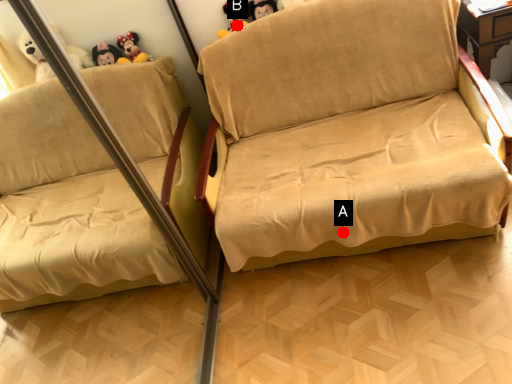
Question: Two points are circled on the image, labeled by A and B beside each circle. Among these points, which one is farthest from the camera?

Choices:
 (A) A is further
 (B) B is further

Answer: (B)